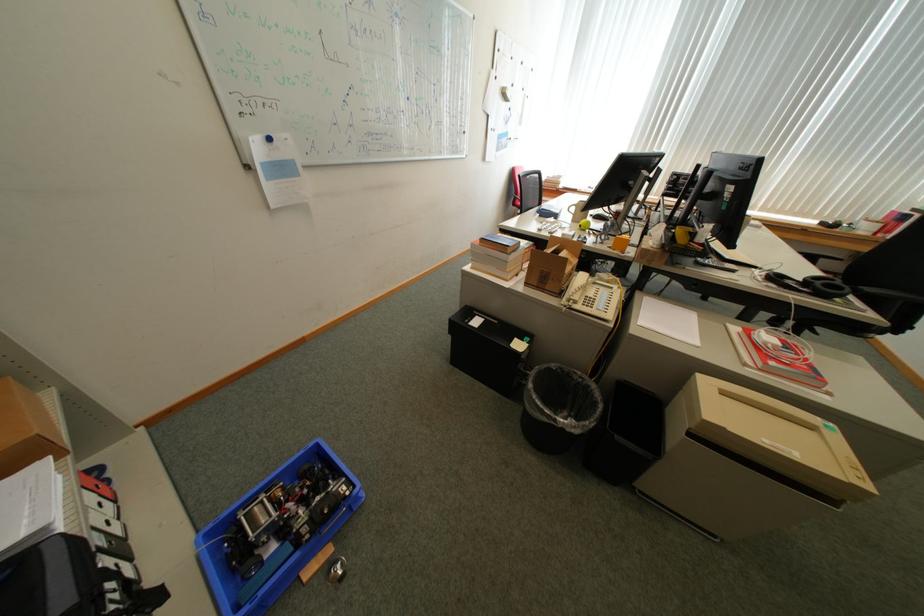
Locate an element on the screen. The image size is (924, 616). beige printer lid is located at coordinates (775, 437).